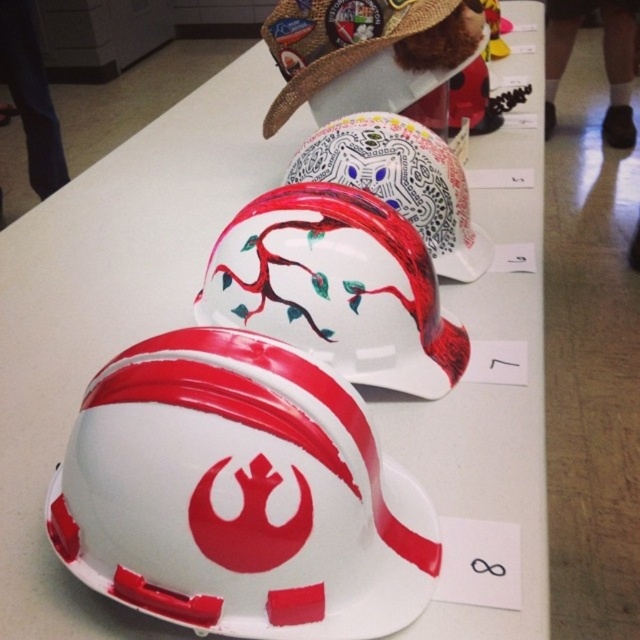
Question: Which object is farther from the camera taking this photo?

Choices:
 (A) white glossy helmet at center
 (B) glossy white helmet at center

Answer: (A)

Question: In this image, where is glossy white helmet at center located relative to white glossy helmet at center?

Choices:
 (A) below
 (B) above

Answer: (A)

Question: Can you confirm if glossy white helmet at center is positioned below white glossy helmet at center?

Choices:
 (A) yes
 (B) no

Answer: (A)

Question: Which point is closer to the camera taking this photo?

Choices:
 (A) (337, 157)
 (B) (300, 81)

Answer: (A)

Question: Where is glossy white helmet at center located in relation to white glossy helmet at center in the image?

Choices:
 (A) above
 (B) below

Answer: (B)

Question: Which point is closer to the camera?

Choices:
 (A) (288, 216)
 (B) (369, 0)

Answer: (A)